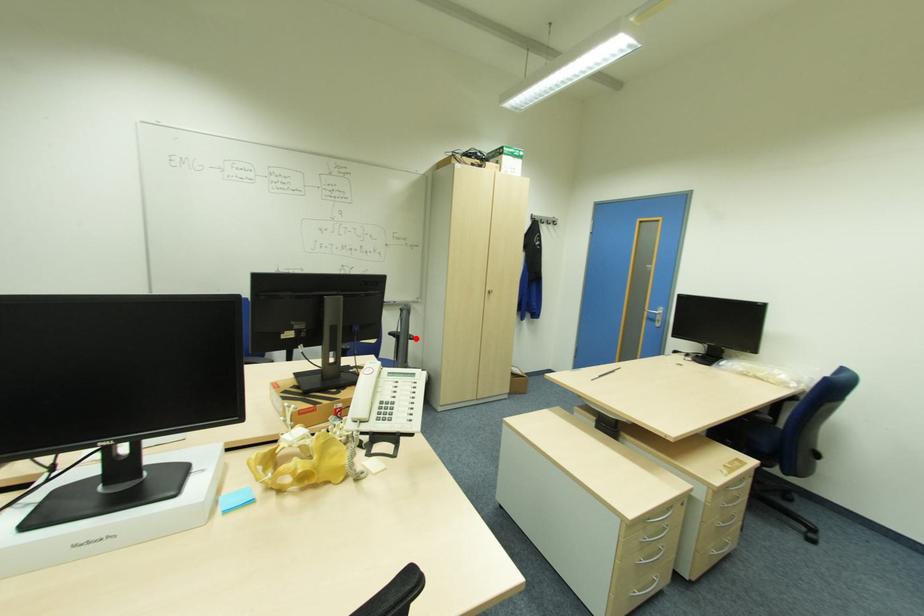
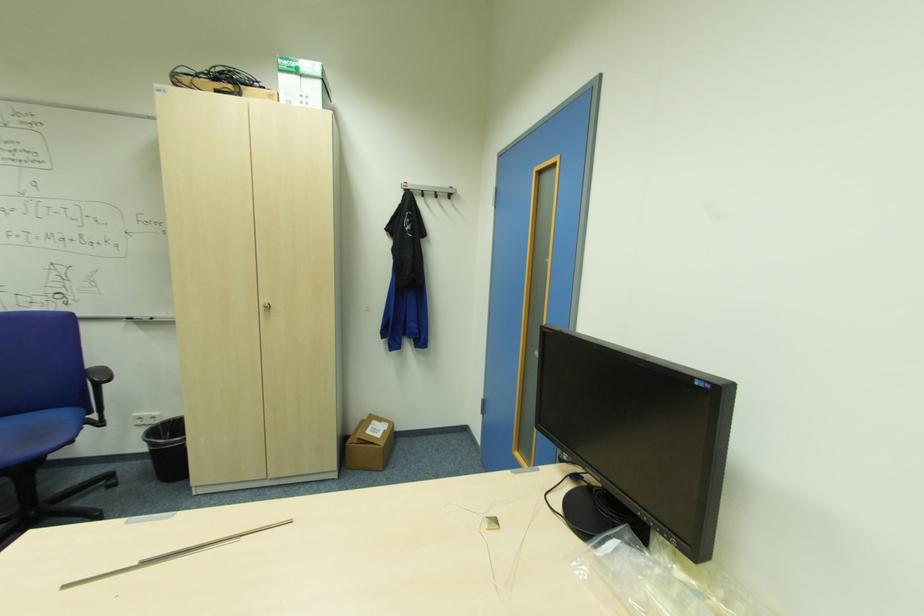
In the second image, find the point that corresponds to the highlighted location in the first image.

(110, 381)